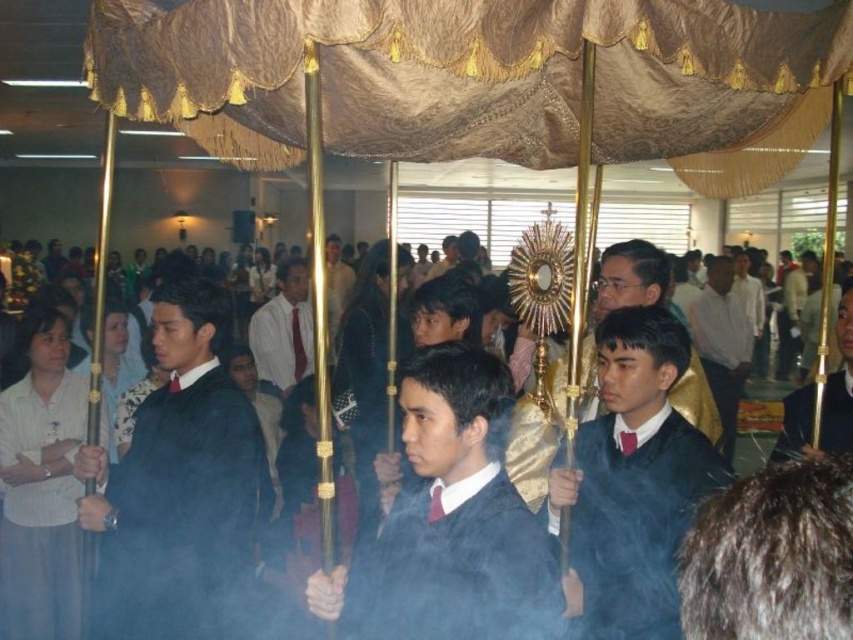
Question: Which object is closer to the camera taking this photo?

Choices:
 (A) white matte robe at lower left
 (B) gold metallic monstrance at center
 (C) matte blue robe at center
 (D) matte black robes at center

Answer: (C)

Question: Is black matte robe at center thinner than gold metallic monstrance at center?

Choices:
 (A) yes
 (B) no

Answer: (A)

Question: Which of the following is the closest to the observer?

Choices:
 (A) click(346, 586)
 (B) click(842, 292)
 (C) click(706, 458)

Answer: (A)

Question: Which point is closer to the camera taking this photo?

Choices:
 (A) (670, 560)
 (B) (723, 365)
 (C) (706, 403)
 (D) (440, 612)

Answer: (D)

Question: Where is black matte robe at center located in relation to gold metallic monstrance at center in the image?

Choices:
 (A) right
 (B) left

Answer: (B)

Question: Is matte blue robe at center below dark blue velvet robe at center?

Choices:
 (A) no
 (B) yes

Answer: (B)